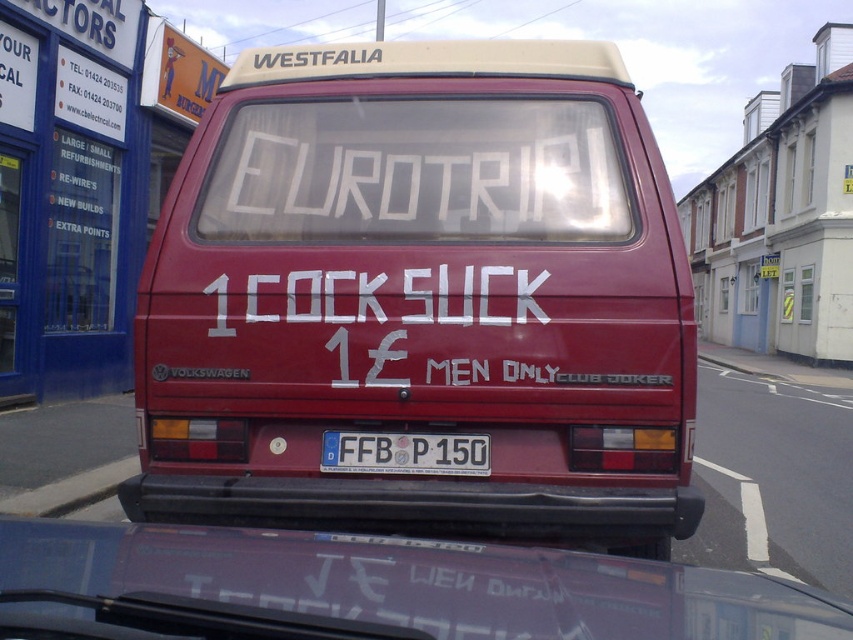
What is the position of the metallic purple car at lower center in the image?

The metallic purple car at lower center is located at point coordinates of 0.922 and 0.436.

What is the exact location of the maroon matte van at center in the image?

The maroon matte van at center is located at point (421, 298).

What is the color of the car located at the point with coordinates [370,589]?

The metallic purple car at lower center is located at point [370,589], so the color is metallic purple.